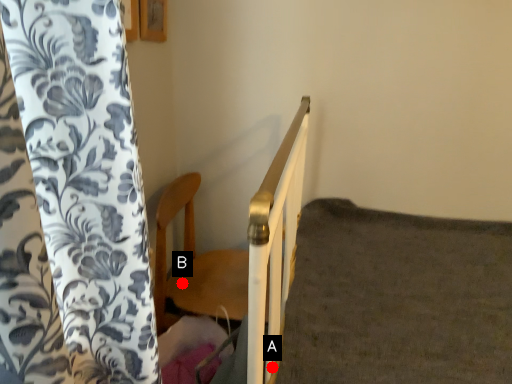
Question: Two points are circled on the image, labeled by A and B beside each circle. Which point appears farthest from the camera in this image?

Choices:
 (A) A is further
 (B) B is further

Answer: (B)